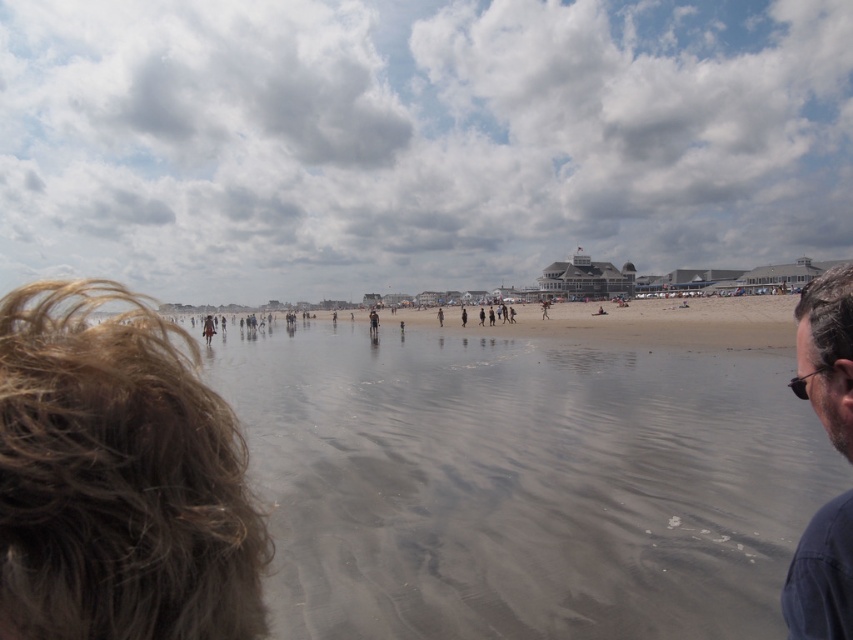
You are standing on the beach and want to walk towards the gray sand at lower center. There is a brown fuzzy hair at lower left in your path. Which object will you encounter first?

The brown fuzzy hair at lower left is closer to you than the gray sand at lower center, so you will encounter the brown fuzzy hair at lower left first.

You are standing on the beach and want to take a photo of both the brown fuzzy hair at lower left and the dark blue shirt at right. Which object should you adjust your camera angle to focus on first to ensure both are in the frame?

Since the brown fuzzy hair at lower left is in front of the dark blue shirt at right, you should focus on the brown fuzzy hair at lower left first to ensure it doesn not block the dark blue shirt at right in the background.